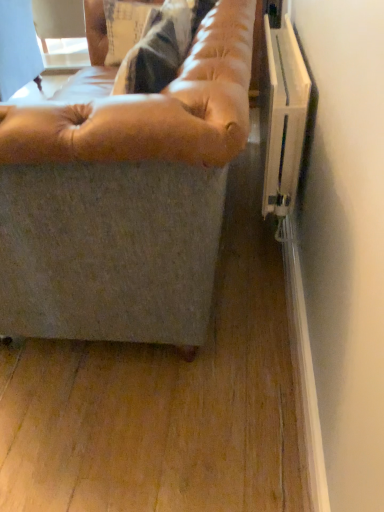
Question: From the image's perspective, is leather-like tan couch at center below leather-like tan bean bag at center?

Choices:
 (A) yes
 (B) no

Answer: (B)

Question: Is leather-like tan couch at center positioned with its back to leather-like tan bean bag at center?

Choices:
 (A) yes
 (B) no

Answer: (A)

Question: Does leather-like tan couch at center appear on the right side of leather-like tan bean bag at center?

Choices:
 (A) no
 (B) yes

Answer: (A)

Question: Is leather-like tan couch at center next to leather-like tan bean bag at center?

Choices:
 (A) no
 (B) yes

Answer: (B)

Question: Can we say leather-like tan couch at center lies outside leather-like tan bean bag at center?

Choices:
 (A) yes
 (B) no

Answer: (A)

Question: Is leather-like tan couch at center far away from leather-like tan bean bag at center?

Choices:
 (A) no
 (B) yes

Answer: (A)

Question: From a real-world perspective, is leather-like tan bean bag at center on leather-like tan couch at center?

Choices:
 (A) yes
 (B) no

Answer: (A)

Question: Is leather-like tan bean bag at center not within leather-like tan couch at center?

Choices:
 (A) no
 (B) yes

Answer: (A)

Question: Is leather-like tan bean bag at center placed right next to leather-like tan couch at center?

Choices:
 (A) yes
 (B) no

Answer: (A)

Question: Is leather-like tan bean bag at center looking in the opposite direction of leather-like tan couch at center?

Choices:
 (A) no
 (B) yes

Answer: (B)

Question: Does leather-like tan bean bag at center appear on the right side of leather-like tan couch at center?

Choices:
 (A) yes
 (B) no

Answer: (A)

Question: Considering the relative sizes of leather-like tan bean bag at center and leather-like tan couch at center in the image provided, is leather-like tan bean bag at center smaller than leather-like tan couch at center?

Choices:
 (A) no
 (B) yes

Answer: (B)

Question: Do you think leather-like tan couch at center is within leather-like tan bean bag at center, or outside of it?

Choices:
 (A) inside
 (B) outside

Answer: (B)